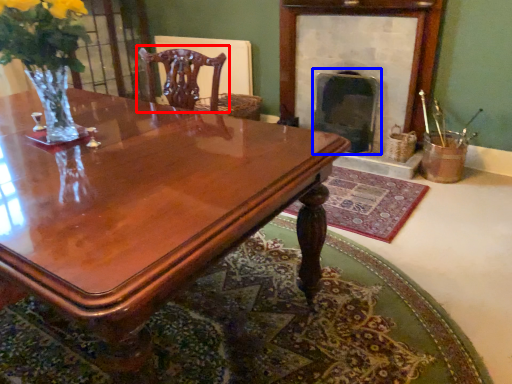
Question: Among these objects, which one is farthest to the camera, chair (highlighted by a red box) or fireplace (highlighted by a blue box)?

Choices:
 (A) chair
 (B) fireplace

Answer: (A)